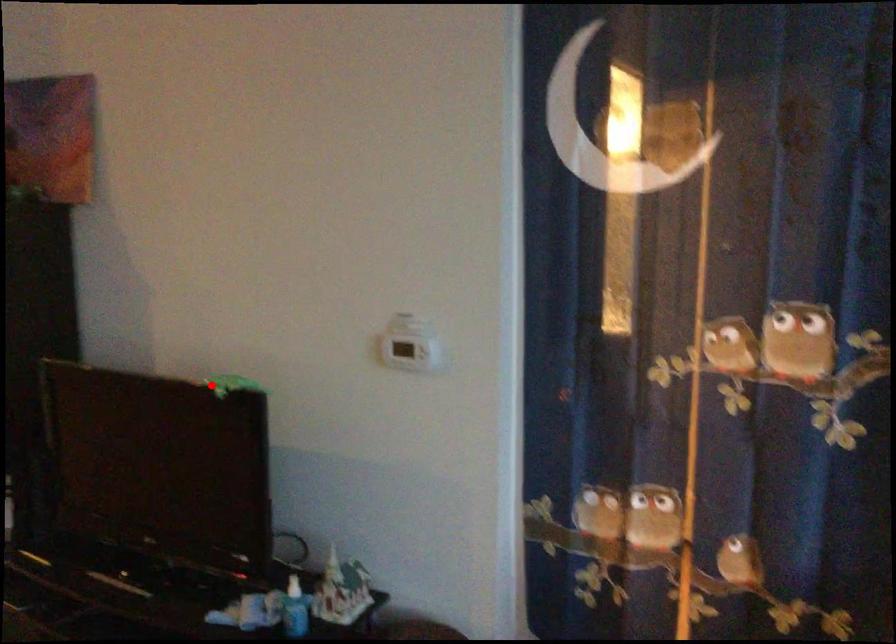
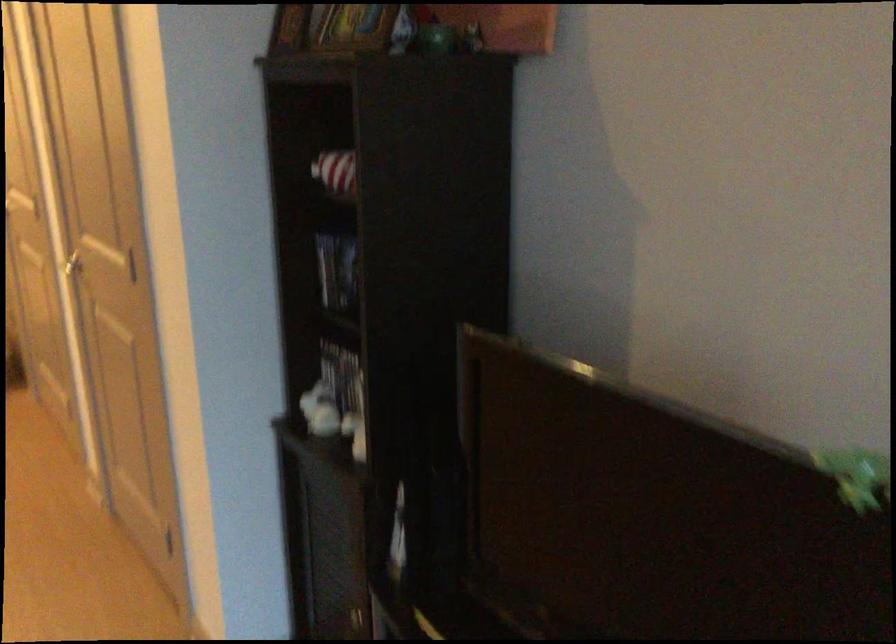
Where in the second image is the point corresponding to the highlighted location from the first image?

(857, 476)